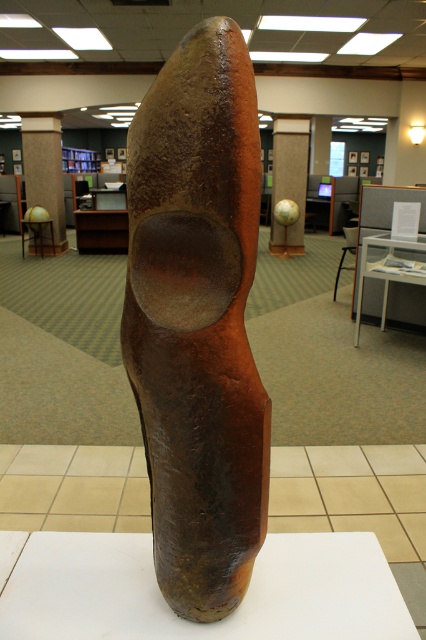
You are standing in the library and see two points on the sculpture. The first point is at coordinate point (x=181, y=396) and the second is at coordinate point (x=273, y=225). Which point is closer to you?

Point (x=181, y=396) is closer to the viewer than point (x=273, y=225).

You are an interior designer planning to place a new floor lamp in this room. The lamp requires a space that is taller than both the rusty metal sculpture at center and the brown textured pillar at center. Based on the current setup, is there enough vertical space for the lamp?

The rusty metal sculpture at center has a lesser height compared to brown textured pillar at center. Therefore, the lamp must be taller than the taller object, which is the brown textured pillar at center. However, without knowing the specific height requirement of the lamp, it is impossible to determine if there is enough vertical space.